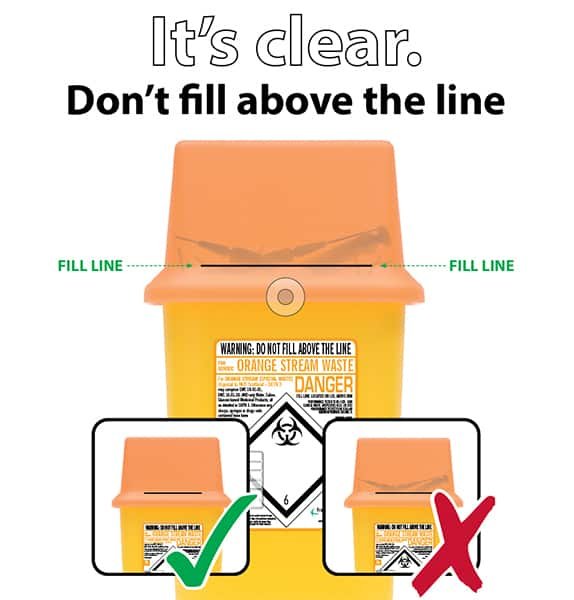
What are the coordinates of `orange cap over trash can` in the screenshot? It's located at (258, 196).